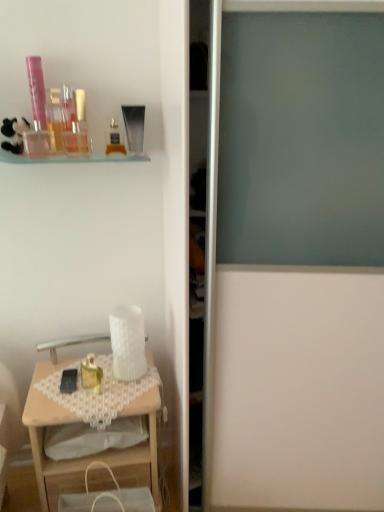
Where is `unoccupied region to the right of gold metallic perfume at lower left, which is the 8th toiletry in top-to-bottom order`? This screenshot has height=512, width=384. unoccupied region to the right of gold metallic perfume at lower left, which is the 8th toiletry in top-to-bottom order is located at coordinates (127, 385).